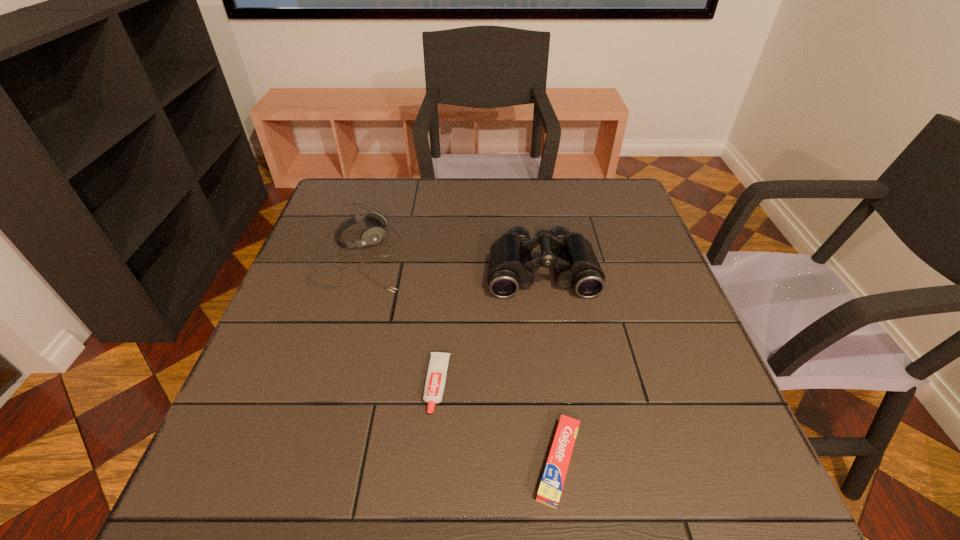
Where is `vacant space located on the back of the right toothpaste`? Image resolution: width=960 pixels, height=540 pixels. vacant space located on the back of the right toothpaste is located at coordinates (543, 348).

This screenshot has height=540, width=960. In order to click on object present at the far edge in this screenshot , I will do `click(373, 235)`.

The image size is (960, 540). In order to click on object present at the near edge in this screenshot , I will do `click(553, 478)`.

I want to click on object situated at the left edge, so click(x=373, y=235).

The height and width of the screenshot is (540, 960). Find the location of `object that is at the far left corner`. object that is at the far left corner is located at coordinates (373, 235).

In the image, there is a desktop. Identify the location of free space at the far edge. (471, 209).

The height and width of the screenshot is (540, 960). In the image, there is a desktop. In order to click on vacant space at the left edge in this screenshot , I will do `click(300, 333)`.

Where is `blank space at the right edge`? This screenshot has width=960, height=540. blank space at the right edge is located at coordinates (722, 419).

Find the location of a particular element. The width and height of the screenshot is (960, 540). vacant space at the far left corner is located at coordinates (369, 192).

Find the location of a particular element. The width and height of the screenshot is (960, 540). vacant area at the far right corner of the desktop is located at coordinates (597, 221).